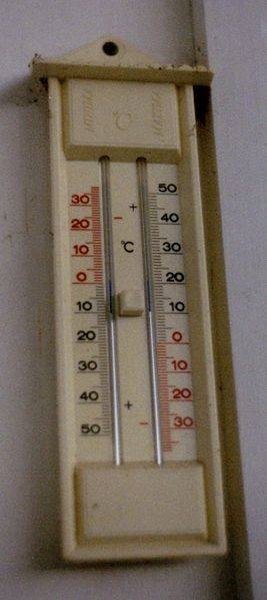
This screenshot has width=267, height=600. I want to click on wall, so click(30, 136), click(261, 497).